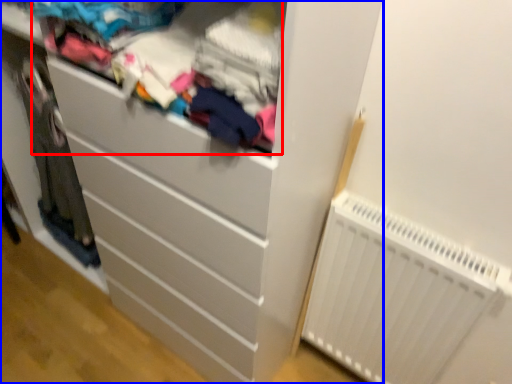
Question: Which object appears closest to the camera in this image, clothing (highlighted by a red box) or chest of drawers (highlighted by a blue box)?

Choices:
 (A) clothing
 (B) chest of drawers

Answer: (A)